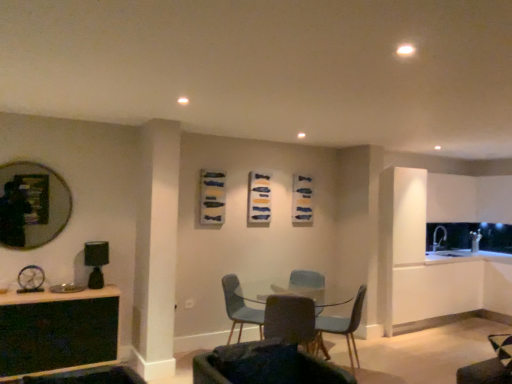
Image resolution: width=512 pixels, height=384 pixels. In order to click on blank area beneath black matte lamp at left (from a real-world perspective) in this screenshot , I will do `click(97, 288)`.